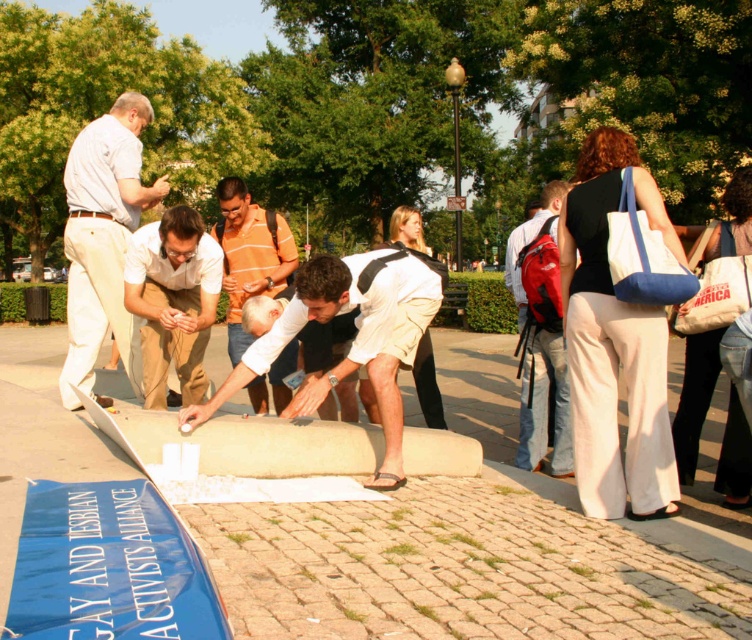
Does point (86, 317) lie behind point (284, 394)?

No, it is in front of (284, 394).

Can you confirm if light beige pants at center is positioned below orange striped shirt at center?

No.

In order to click on light beige pants at center in this screenshot , I will do `click(102, 237)`.

Is point (378, 589) more distant than point (196, 289)?

That is False.

Which is behind, point (262, 568) or point (165, 275)?

Point (165, 275)

You are a GUI agent. You are given a task and a screenshot of the screen. Output one action in this format:
    pyautogui.click(x=<x>, y=<y>)
    Task: Click on the smooth concrete pavement at center
    Image resolution: width=752 pixels, height=640 pixels.
    Given the screenshot: What is the action you would take?
    pyautogui.click(x=478, y=547)

At what (x,y) coordinates should I click in order to perform the action: click on smooth concrete pavement at center. Please return your answer as a coordinate pair (x, y). This screenshot has height=640, width=752. Looking at the image, I should click on (478, 547).

Which is in front, point (188, 410) or point (546, 348)?

Point (188, 410) is more forward.

Between smooth concrete cylinder at center and matte red backpack at center, which one has less height?

matte red backpack at center

Between point (368, 280) and point (553, 188), which one is positioned behind?

Positioned behind is point (553, 188).

This screenshot has width=752, height=640. Identify the location of smooth concrete cylinder at center. (352, 340).